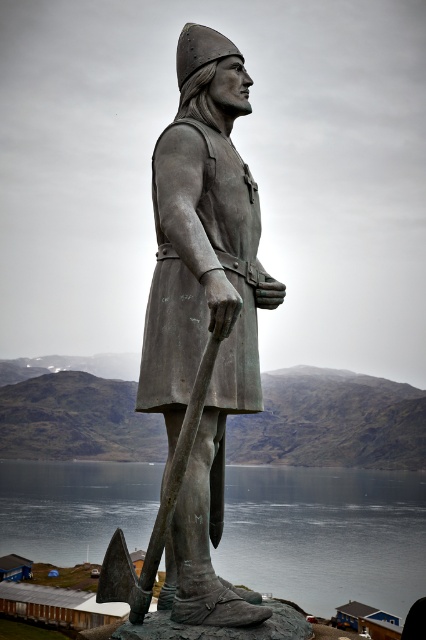
You are an art student analyzing the positioning of objects in the scene. According to the description, where is the bronze statue at center in relation to the bronze textured axe at center?

The bronze statue at center is to the right of the bronze textured axe at center.

You are a tourist standing at the base of the bronze statue at center. You notice a specific point marked at coordinates (x=204, y=310). Can you determine if this point is located on the statue itself or somewhere else in the scene?

The point at coordinates (x=204, y=310) is on the bronze statue at center, so yes, it is located on the statue itself.